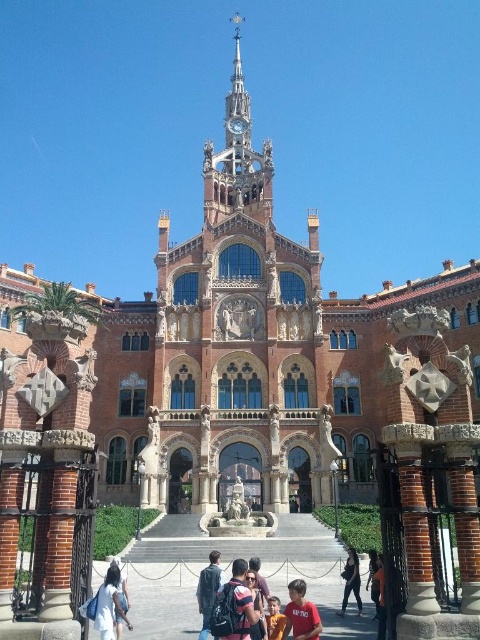
You are a photographer planning to capture a group photo of two people wearing the white cotton dress at lower left and the red shirt at lower center. The photographer wants to ensure both subjects are clearly visible in the frame. Which clothing item should be positioned closer to the camera to avoid being obscured by the other?

The white cotton dress at lower left should be positioned closer to the camera because it occupies less space than the red shirt at lower center, making it easier to ensure both are visible without one blocking the other.

You are standing in front of the grand Gothic Revival building. You see a white cotton dress at lower left and a striped fabric backpack at center. Which object is wider?

The white cotton dress at lower left is wider than the striped fabric backpack at center.

You are attending a formal event and need to choose between the white cotton dress at lower left and the red shirt at lower center for your outfit. Which option provides more coverage due to its width?

The white cotton dress at lower left has a larger width than the red shirt at lower center, so it provides more coverage.